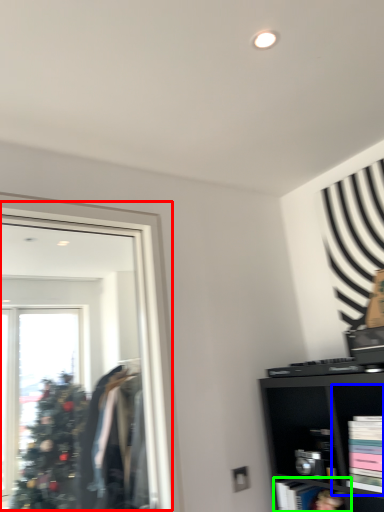
Question: Based on their relative distances, which object is farther from mirror (highlighted by a red box)? Choose from cabinet (highlighted by a blue box) and cabinet (highlighted by a green box).

Choices:
 (A) cabinet
 (B) cabinet

Answer: (A)